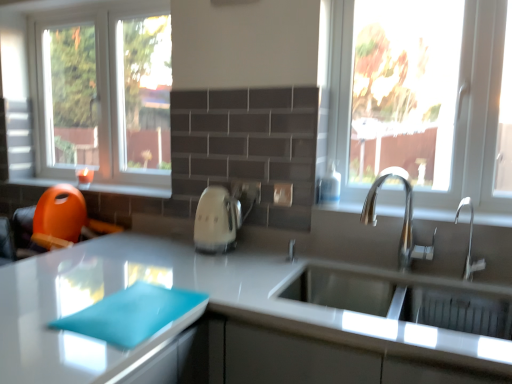
Identify the location of vacant location below silver metallic faucet at center, placed as the first tap when sorted from left to right (from a real-world perspective). (396, 271).